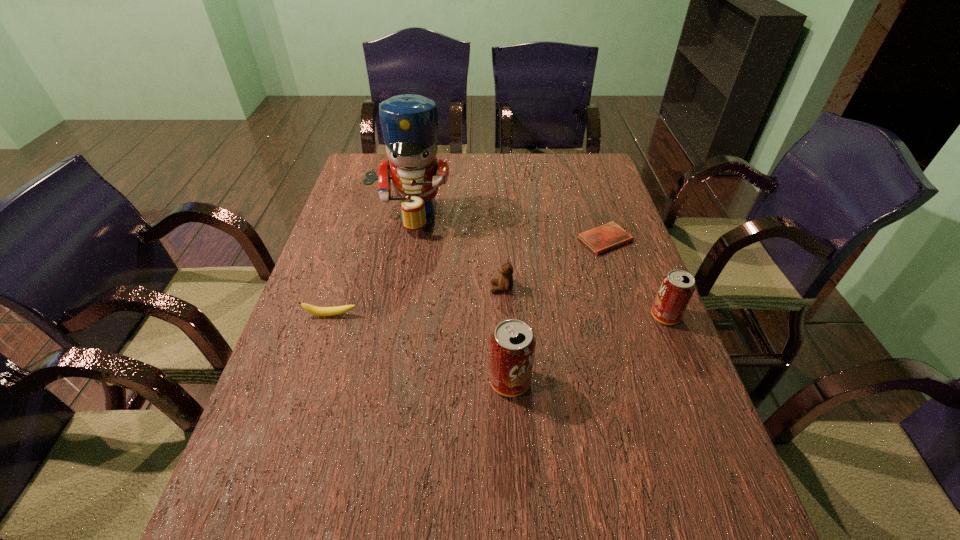
Find the location of `vacant place for an extra soda can on the left`. vacant place for an extra soda can on the left is located at coordinates (304, 468).